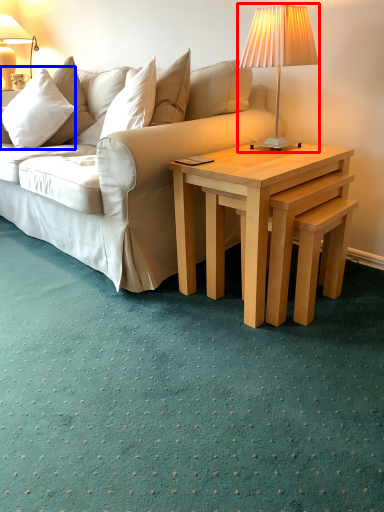
Question: Which of the following is the farthest to the observer, lamp (highlighted by a red box) or pillow (highlighted by a blue box)?

Choices:
 (A) lamp
 (B) pillow

Answer: (B)